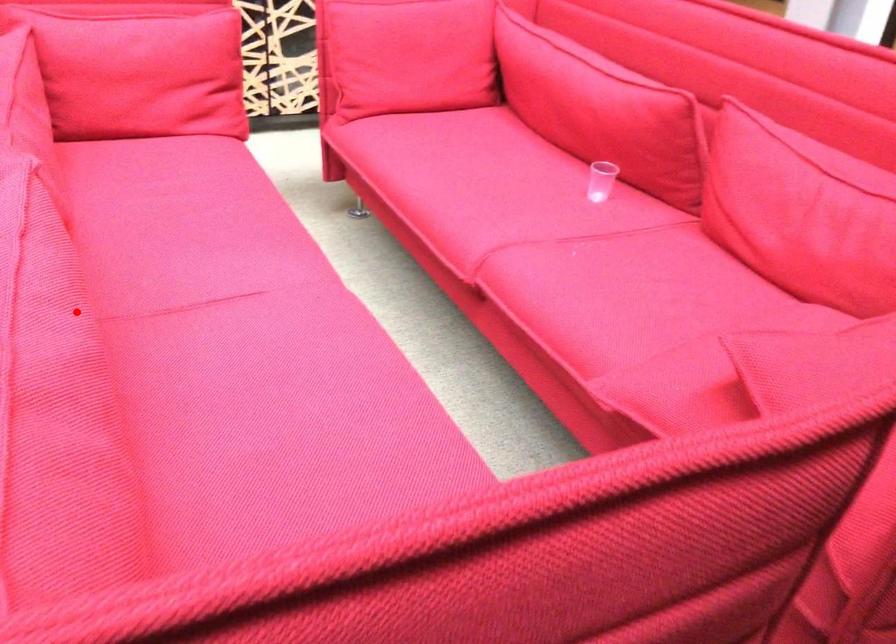
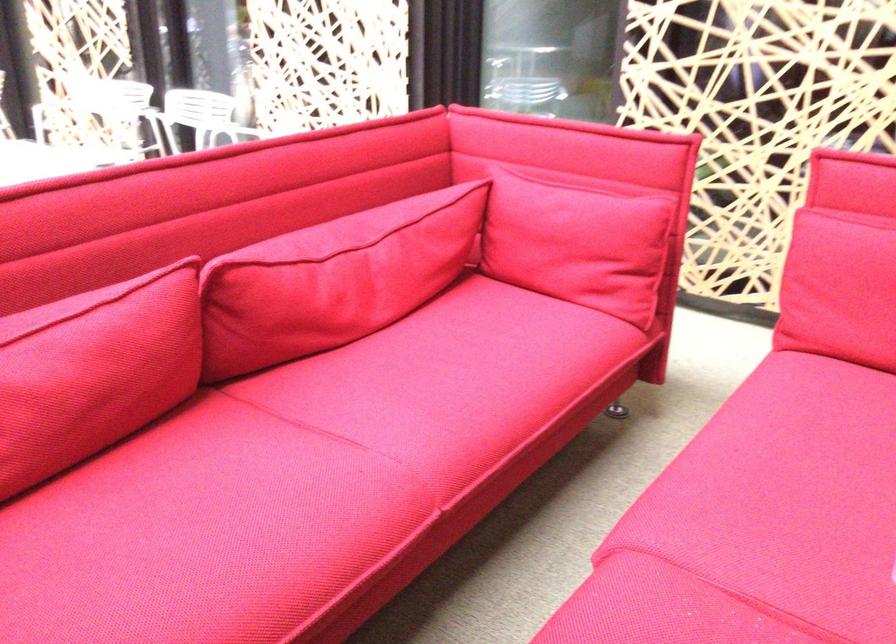
Locate, in the second image, the point that corresponds to the highlighted location in the first image.

(93, 371)